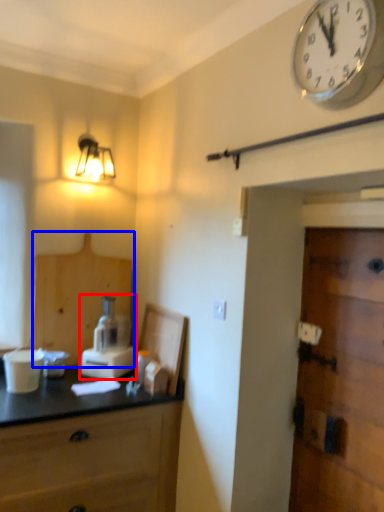
Question: Which of the following is the closest to the observer, blender (highlighted by a red box) or cabinetry (highlighted by a blue box)?

Choices:
 (A) blender
 (B) cabinetry

Answer: (A)